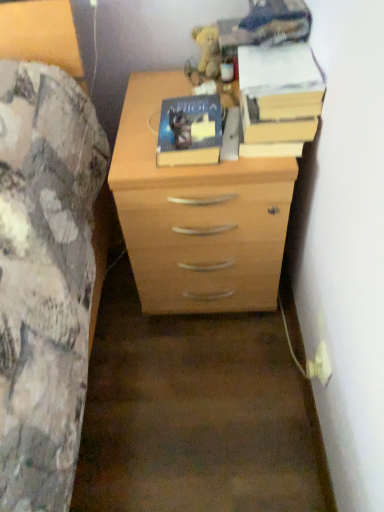
The image size is (384, 512). I want to click on vacant space in front of light wood chest of drawers at center, so click(x=202, y=386).